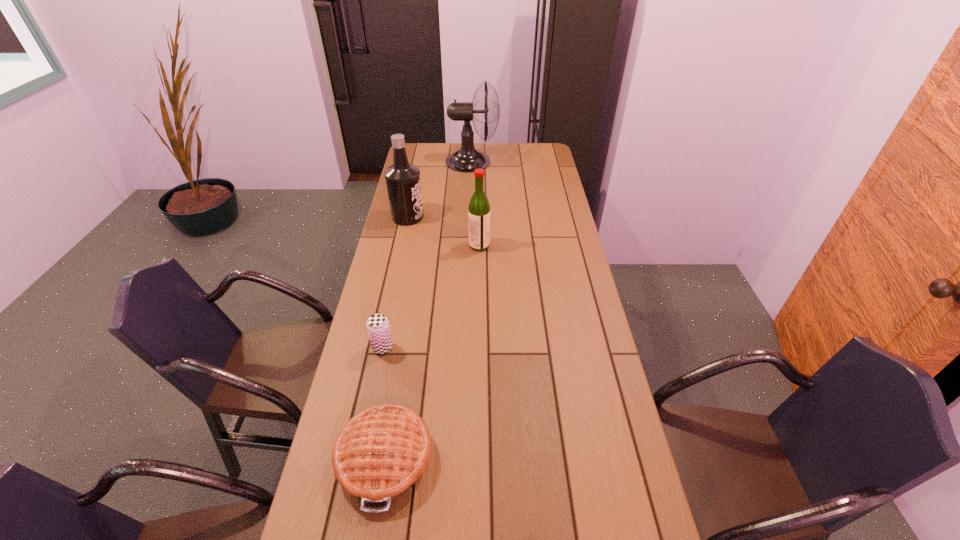
Find the location of a particular element. This screenshot has width=960, height=540. the farthest object is located at coordinates (467, 159).

The width and height of the screenshot is (960, 540). Identify the location of the farther liquor. pos(403,184).

Find the location of a particular element. the second farthest object is located at coordinates (403, 184).

At what (x,y) coordinates should I click in order to perform the action: click on the nearer liquor. Please return your answer as a coordinate pair (x, y). Image resolution: width=960 pixels, height=540 pixels. Looking at the image, I should click on (479, 208).

Find the location of a particular element. the right liquor is located at coordinates (479, 208).

Locate an element on the screen. This screenshot has width=960, height=540. beer can is located at coordinates (377, 325).

I want to click on the fourth farthest object, so click(x=377, y=325).

Locate an element on the screen. the shortest object is located at coordinates (380, 454).

Locate an element on the screen. The width and height of the screenshot is (960, 540). the nearest object is located at coordinates (380, 454).

Identify the location of free space located 0.250m on the front-facing side of the fan. This screenshot has width=960, height=540. (547, 161).